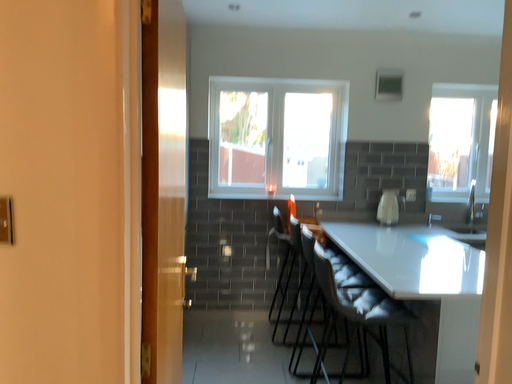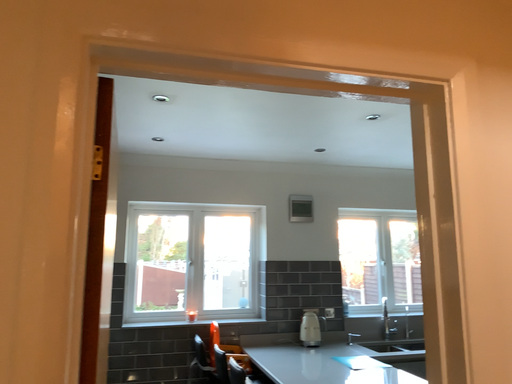
Question: How did the camera likely rotate when shooting the video?

Choices:
 (A) rotated upward
 (B) rotated downward

Answer: (A)